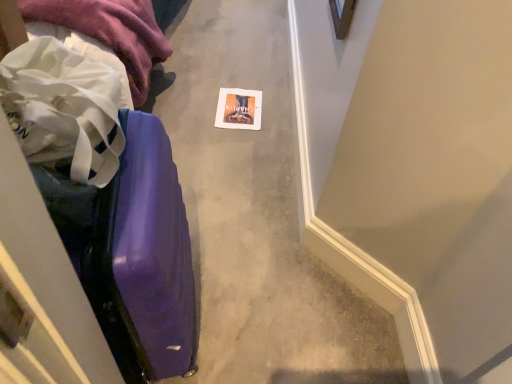
Describe the element at coordinates (239, 109) in the screenshot. I see `matte paper postcard at center` at that location.

You are a GUI agent. You are given a task and a screenshot of the screen. Output one action in this format:
    pyautogui.click(x=<x>, y=<y>)
    Task: Click on the white fabric at left
    Image resolution: width=512 pixels, height=384 pixels.
    Given the screenshot: What is the action you would take?
    pyautogui.click(x=114, y=31)

The height and width of the screenshot is (384, 512). I want to click on matte paper postcard at center, so click(x=239, y=109).

From the picture: Is white fabric at left to the right of purple glossy suitcase at left from the viewer's perspective?

No.

How different are the orientations of white fabric at left and purple glossy suitcase at left in degrees?

7.57 degrees.

Is white fabric at left far away from purple glossy suitcase at left?

white fabric at left is actually quite close to purple glossy suitcase at left.

Between purple glossy suitcase at left and white fabric at left, which one has more height?

purple glossy suitcase at left is taller.

From the image's perspective, is purple glossy suitcase at left under white fabric at left?

Correct, purple glossy suitcase at left appears lower than white fabric at left in the image.

Consider the image. Is purple glossy suitcase at left surrounding white fabric at left?

Definitely not — white fabric at left is not inside purple glossy suitcase at left.

Is matte paper postcard at center oriented away from purple glossy suitcase at left?

No, matte paper postcard at center is not facing the opposite direction of purple glossy suitcase at left.

Based on their sizes in the image, would you say matte paper postcard at center is bigger or smaller than purple glossy suitcase at left?

Considering their sizes, matte paper postcard at center takes up less space than purple glossy suitcase at left.

In the scene shown: Which object is thinner, matte paper postcard at center or purple glossy suitcase at left?

matte paper postcard at center.

Is matte paper postcard at center not near purple glossy suitcase at left?

Absolutely, matte paper postcard at center is distant from purple glossy suitcase at left.

Based on their sizes in the image, would you say white fabric at left is bigger or smaller than matte paper postcard at center?

white fabric at left is bigger than matte paper postcard at center.

Would you say white fabric at left is inside or outside matte paper postcard at center?

white fabric at left cannot be found inside matte paper postcard at center.

From the picture: Relative to matte paper postcard at center, is white fabric at left in front or behind?

white fabric at left is in front of matte paper postcard at center.

How far apart are white fabric at left and matte paper postcard at center?

white fabric at left and matte paper postcard at center are 18.73 inches apart from each other.

Is point (112, 270) in front of point (224, 100)?

Yes, point (112, 270) is closer to viewer.

Considering the sizes of objects purple glossy suitcase at left and matte paper postcard at center in the image provided, who is smaller, purple glossy suitcase at left or matte paper postcard at center?

matte paper postcard at center.

Is purple glossy suitcase at left oriented away from matte paper postcard at center?

No, purple glossy suitcase at left is not facing the opposite direction of matte paper postcard at center.

From a real-world perspective, which is physically above, purple glossy suitcase at left or matte paper postcard at center?

purple glossy suitcase at left, from a real-world perspective.

From a real-world perspective, between matte paper postcard at center and white fabric at left, who is vertically lower?

matte paper postcard at center is physically lower.

Is matte paper postcard at center positioned with its back to white fabric at left?

No.

From the image's perspective, does matte paper postcard at center appear higher than white fabric at left?

Actually, matte paper postcard at center appears below white fabric at left in the image.

Is matte paper postcard at center thinner than white fabric at left?

Correct, the width of matte paper postcard at center is less than that of white fabric at left.

In order to click on luggage on the right of white fabric at left in this screenshot , I will do `click(143, 259)`.

The image size is (512, 384). In order to click on luggage above the white fabric at left (from a real-world perspective) in this screenshot , I will do `click(143, 259)`.

Which object lies further to the anchor point matte paper postcard at center, purple glossy suitcase at left or white fabric at left?

purple glossy suitcase at left lies further to matte paper postcard at center than the other object.

From the picture: When comparing their distances from purple glossy suitcase at left, does matte paper postcard at center or white fabric at left seem closer?

white fabric at left.

From the image, which object appears to be farther from white fabric at left, matte paper postcard at center or purple glossy suitcase at left?

purple glossy suitcase at left is further to white fabric at left.

Based on the photo, based on their spatial positions, is purple glossy suitcase at left or matte paper postcard at center further from white fabric at left?

Based on the image, purple glossy suitcase at left appears to be further to white fabric at left.

Considering their positions, is white fabric at left positioned closer to purple glossy suitcase at left than matte paper postcard at center?

white fabric at left.

Which object lies further to the anchor point matte paper postcard at center, white fabric at left or purple glossy suitcase at left?

Among the two, purple glossy suitcase at left is located further to matte paper postcard at center.

Where is `clothing between purple glossy suitcase at left and matte paper postcard at center along the z-axis`? This screenshot has width=512, height=384. clothing between purple glossy suitcase at left and matte paper postcard at center along the z-axis is located at coordinates (114, 31).